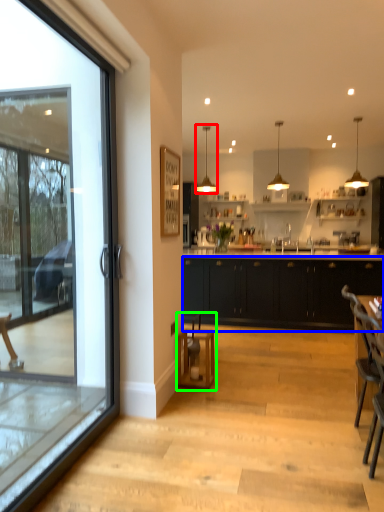
Question: Which is farther away from lamp (highlighted by a red box)? cabinetry (highlighted by a blue box) or bar stool (highlighted by a green box)?

Choices:
 (A) cabinetry
 (B) bar stool

Answer: (B)